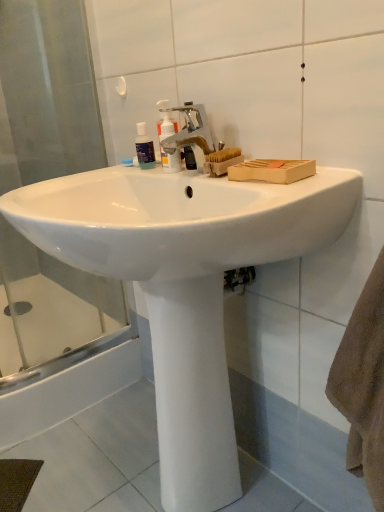
Question: From the image's perspective, relative to white smooth pedestal at center, is silver metallic faucet at center above or below?

Choices:
 (A) above
 (B) below

Answer: (A)

Question: Considering their positions, is silver metallic faucet at center located in front of or behind white smooth pedestal at center?

Choices:
 (A) front
 (B) behind

Answer: (B)

Question: Which object is positioned farthest from the translucent plastic pump bottle at center?

Choices:
 (A) transparent glass shower door at left
 (B) white glossy sink at center
 (C) white smooth pedestal at center
 (D) transparent plastic bottle at upper center
 (E) silver metallic faucet at center

Answer: (A)

Question: Which object is the closest to the transparent glass shower door at left?

Choices:
 (A) transparent plastic bottle at upper center
 (B) silver metallic faucet at center
 (C) white smooth pedestal at center
 (D) white glossy sink at center
 (E) translucent plastic pump bottle at center

Answer: (D)